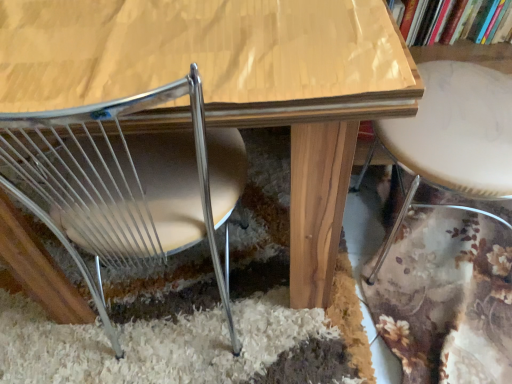
What do you see at coordinates (440, 19) in the screenshot?
I see `hardcover book at upper right` at bounding box center [440, 19].

In order to face white marble bar stool at right, should I rotate leftwards or rightwards?

You should look right and rotate roughly 29.137 degrees.

The height and width of the screenshot is (384, 512). What do you see at coordinates (230, 84) in the screenshot? I see `wooden table at center` at bounding box center [230, 84].

Locate an element on the screen. hardcover book at upper right is located at coordinates (440, 19).

Considering the relative sizes of white marble bar stool at right and hardcover book at upper right in the image provided, is white marble bar stool at right thinner than hardcover book at upper right?

No, white marble bar stool at right is not thinner than hardcover book at upper right.

Between point (487, 151) and point (446, 37), which one is positioned in front?

The point (487, 151) is closer to the camera.

Are white marble bar stool at right and hardcover book at upper right far apart?

No, white marble bar stool at right is in close proximity to hardcover book at upper right.

Is white marble bar stool at right aimed at hardcover book at upper right?

No, white marble bar stool at right is not turned towards hardcover book at upper right.

Is wooden table at center located outside hardcover book at upper right?

That's correct, wooden table at center is outside of hardcover book at upper right.

Can you confirm if wooden table at center is smaller than hardcover book at upper right?

No.

From the image's perspective, is wooden table at center beneath hardcover book at upper right?

Yes, from the image's perspective, wooden table at center is below hardcover book at upper right.

From a real-world perspective, relative to metallic wire chair at lower left, is wooden table at center vertically above or below?

Clearly, from a real-world perspective, wooden table at center is below metallic wire chair at lower left.

How much distance is there between wooden table at center and metallic wire chair at lower left?

6.41 inches.

Do you think wooden table at center is within metallic wire chair at lower left, or outside of it?

wooden table at center is outside metallic wire chair at lower left.

Looking at this image, between wooden table at center and metallic wire chair at lower left, which one appears on the right side from the viewer's perspective?

wooden table at center.

Is hardcover book at upper right behind wooden table at center?

Yes, it is behind wooden table at center.

From the image's perspective, is hardcover book at upper right under wooden table at center?

Incorrect, from the image's perspective, hardcover book at upper right is higher than wooden table at center.

Can you confirm if hardcover book at upper right is wider than wooden table at center?

Incorrect, the width of hardcover book at upper right does not surpass that of wooden table at center.

From a real-world perspective, is hardcover book at upper right located beneath wooden table at center?

No.

From a real-world perspective, does white marble bar stool at right sit lower than wooden table at center?

No.

Is point (456, 95) in front of point (152, 11)?

No.

The height and width of the screenshot is (384, 512). In the image, there is a white marble bar stool at right. Find the location of `table below it (from a real-world perspective)`. table below it (from a real-world perspective) is located at coordinates (230, 84).

Considering the relative sizes of white marble bar stool at right and wooden table at center in the image provided, is white marble bar stool at right shorter than wooden table at center?

Incorrect, the height of white marble bar stool at right does not fall short of that of wooden table at center.

In the image, is hardcover book at upper right positioned in front of or behind white marble bar stool at right?

hardcover book at upper right is positioned farther from the viewer than white marble bar stool at right.

Find the location of a particular element. This screenshot has height=384, width=512. bar stool in front of the hardcover book at upper right is located at coordinates (453, 137).

In terms of width, does hardcover book at upper right look wider or thinner when compared to white marble bar stool at right?

Considering their sizes, hardcover book at upper right looks slimmer than white marble bar stool at right.

From a real-world perspective, is hardcover book at upper right physically below white marble bar stool at right?

No, from a real-world perspective, hardcover book at upper right is not below white marble bar stool at right.

Is metallic wire chair at lower left positioned beyond the bounds of white marble bar stool at right?

Absolutely, metallic wire chair at lower left is external to white marble bar stool at right.

Is metallic wire chair at lower left to the left of white marble bar stool at right from the viewer's perspective?

Indeed, metallic wire chair at lower left is positioned on the left side of white marble bar stool at right.

Between metallic wire chair at lower left and white marble bar stool at right, which one is positioned in front?

metallic wire chair at lower left.

Locate an element on the screen. The image size is (512, 384). bar stool in front of the hardcover book at upper right is located at coordinates (453, 137).

This screenshot has height=384, width=512. What are the coordinates of `table below the hardcover book at upper right (from the image's perspective)` in the screenshot? It's located at (230, 84).

Looking at this image, considering their positions, is white marble bar stool at right positioned further to wooden table at center than metallic wire chair at lower left?

white marble bar stool at right is positioned further to the anchor wooden table at center.

When comparing their distances from hardcover book at upper right, does metallic wire chair at lower left or white marble bar stool at right seem closer?

Based on the image, white marble bar stool at right appears to be nearer to hardcover book at upper right.

From the image, which object appears to be farther from white marble bar stool at right, wooden table at center or hardcover book at upper right?

Based on the image, wooden table at center appears to be further to white marble bar stool at right.

Which object lies nearer to the anchor point wooden table at center, hardcover book at upper right or metallic wire chair at lower left?

metallic wire chair at lower left.

Which object lies nearer to the anchor point wooden table at center, hardcover book at upper right or white marble bar stool at right?

white marble bar stool at right.

When comparing their distances from metallic wire chair at lower left, does hardcover book at upper right or wooden table at center seem further?

The object further to metallic wire chair at lower left is hardcover book at upper right.

In the scene shown: From the image, which object appears to be farther from hardcover book at upper right, metallic wire chair at lower left or wooden table at center?

metallic wire chair at lower left.

From the image, which object appears to be nearer to metallic wire chair at lower left, white marble bar stool at right or hardcover book at upper right?

Among the two, white marble bar stool at right is located nearer to metallic wire chair at lower left.

At what (x,y) coordinates should I click in order to perform the action: click on book between wooden table at center and white marble bar stool at right in the horizontal direction. Please return your answer as a coordinate pair (x, y). The height and width of the screenshot is (384, 512). Looking at the image, I should click on (440, 19).

Locate an element on the screen. book located between metallic wire chair at lower left and white marble bar stool at right in the left-right direction is located at coordinates point(440,19).

Identify the location of table situated between metallic wire chair at lower left and white marble bar stool at right from left to right. (230, 84).

This screenshot has width=512, height=384. Find the location of `table between metallic wire chair at lower left and hardcover book at upper right from left to right`. table between metallic wire chair at lower left and hardcover book at upper right from left to right is located at coordinates (230, 84).